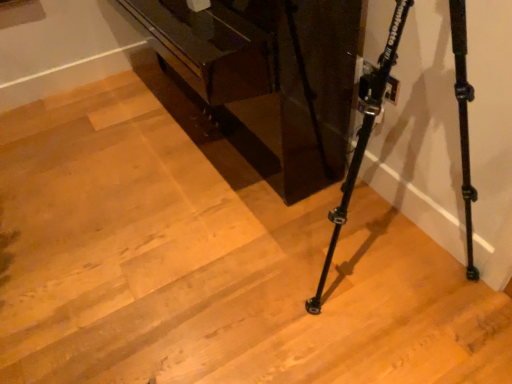
Locate an element on the screen. The height and width of the screenshot is (384, 512). free space to the left of glossy dark wood piano at center is located at coordinates (74, 152).